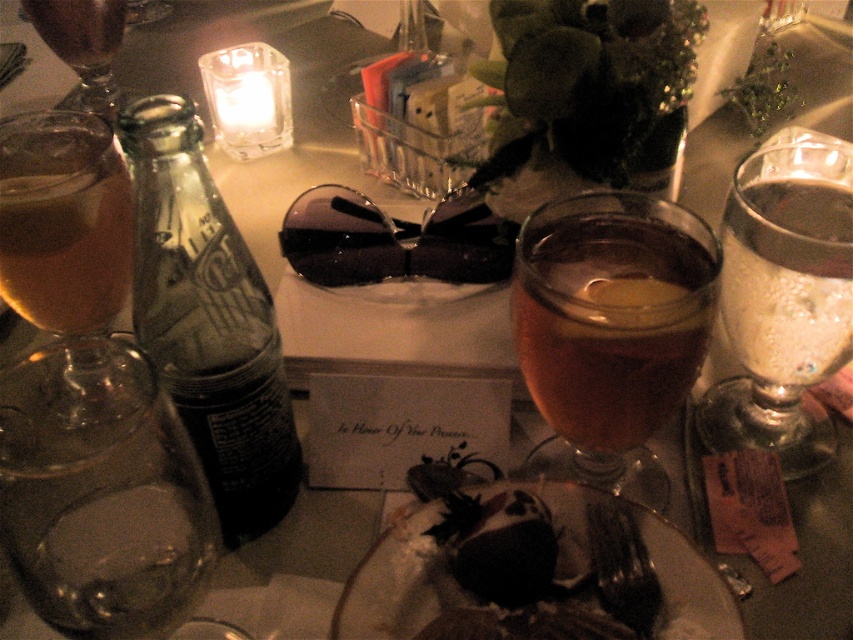
Question: Which object appears closest to the camera in this image?

Choices:
 (A) clear glass bottle at left
 (B) black plastic fork at lower center
 (C) translucent glass at center

Answer: (A)

Question: Estimate the real-world distances between objects in this image. Which object is closer to the dark glass wine at upper left?

Choices:
 (A) matte glass wine at upper left
 (B) clear glass wine glass at upper right
 (C) transparent glass at left
 (D) dark chocolate cake at center

Answer: (A)

Question: Estimate the real-world distances between objects in this image. Which object is closer to the dark chocolate cake at center?

Choices:
 (A) matte glass wine at upper left
 (B) dark glass wine at upper left

Answer: (B)

Question: Is translucent glass wine at left to the left of matte glass wine at upper left from the viewer's perspective?

Choices:
 (A) yes
 (B) no

Answer: (B)

Question: Does clear glass bottle at left appear over clear glass wine glass at upper right?

Choices:
 (A) yes
 (B) no

Answer: (B)

Question: Can you confirm if dark chocolate cake at center is bigger than clear glass bottle at left?

Choices:
 (A) yes
 (B) no

Answer: (B)